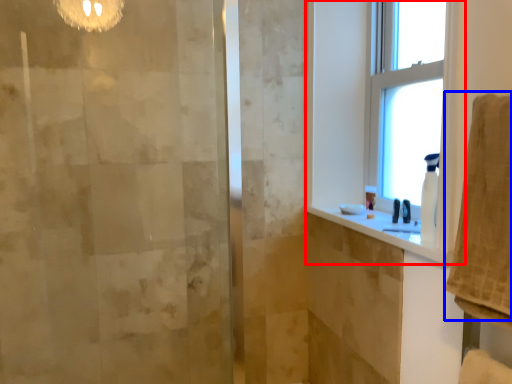
Question: Which object appears farthest to the camera in this image, window (highlighted by a red box) or bath towel (highlighted by a blue box)?

Choices:
 (A) window
 (B) bath towel

Answer: (A)